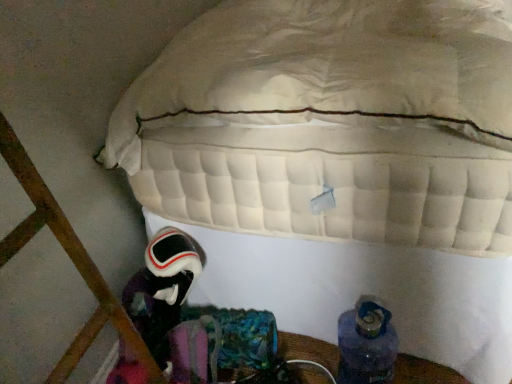
Question: Considering the relative sizes of velvet-like black astronaut at lower left and blue fabric boot at lower right in the image provided, is velvet-like black astronaut at lower left bigger than blue fabric boot at lower right?

Choices:
 (A) yes
 (B) no

Answer: (A)

Question: Is velvet-like black astronaut at lower left surrounding blue fabric boot at lower right?

Choices:
 (A) yes
 (B) no

Answer: (B)

Question: Considering the relative sizes of velvet-like black astronaut at lower left and blue fabric boot at lower right in the image provided, is velvet-like black astronaut at lower left taller than blue fabric boot at lower right?

Choices:
 (A) no
 (B) yes

Answer: (B)

Question: Would you say velvet-like black astronaut at lower left is a long distance from blue fabric boot at lower right?

Choices:
 (A) yes
 (B) no

Answer: (B)

Question: Is velvet-like black astronaut at lower left shorter than blue fabric boot at lower right?

Choices:
 (A) no
 (B) yes

Answer: (A)

Question: Does velvet-like black astronaut at lower left have a smaller size compared to blue fabric boot at lower right?

Choices:
 (A) yes
 (B) no

Answer: (B)

Question: Does blue fabric boot at lower right appear on the right side of velvet-like black astronaut at lower left?

Choices:
 (A) no
 (B) yes

Answer: (B)

Question: From the image's perspective, is blue fabric boot at lower right on velvet-like black astronaut at lower left?

Choices:
 (A) yes
 (B) no

Answer: (B)

Question: Is blue fabric boot at lower right shorter than velvet-like black astronaut at lower left?

Choices:
 (A) no
 (B) yes

Answer: (B)

Question: Is the depth of blue fabric boot at lower right greater than that of velvet-like black astronaut at lower left?

Choices:
 (A) yes
 (B) no

Answer: (B)

Question: From a real-world perspective, does blue fabric boot at lower right sit lower than velvet-like black astronaut at lower left?

Choices:
 (A) no
 (B) yes

Answer: (B)

Question: Does blue fabric boot at lower right turn towards velvet-like black astronaut at lower left?

Choices:
 (A) yes
 (B) no

Answer: (B)

Question: In the image, is blue fabric boot at lower right positioned in front of or behind velvet-like black astronaut at lower left?

Choices:
 (A) front
 (B) behind

Answer: (A)